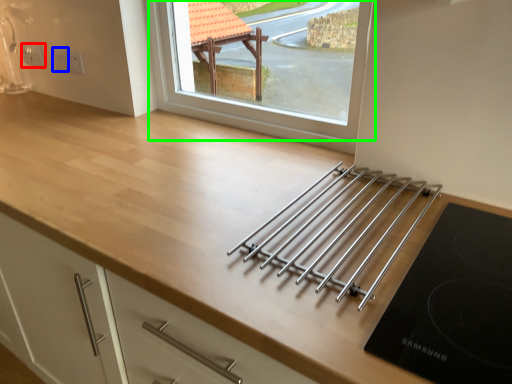
Question: Which object is the closest to the electric outlet (highlighted by a red box)? Choose among these: electric outlet (highlighted by a blue box) or window (highlighted by a green box).

Choices:
 (A) electric outlet
 (B) window

Answer: (A)